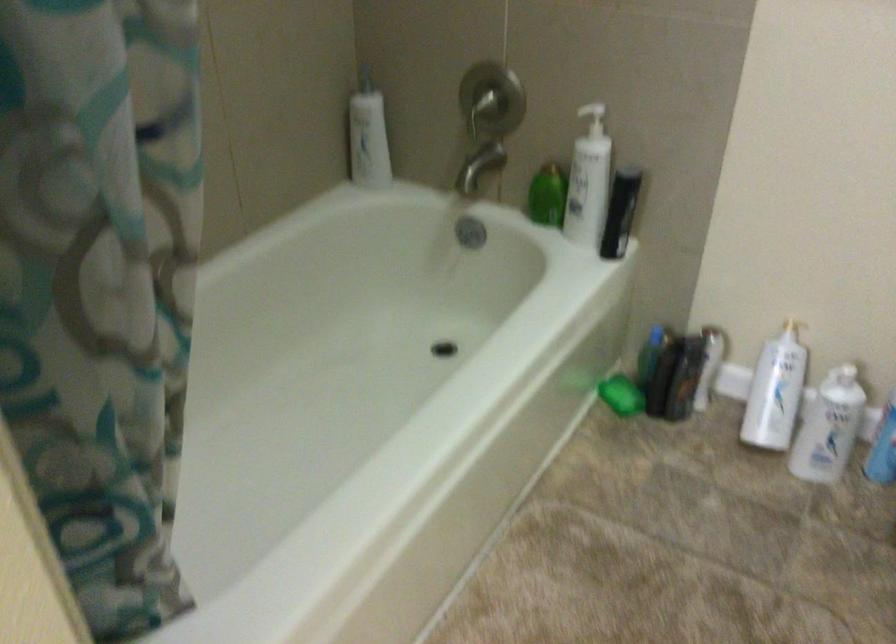
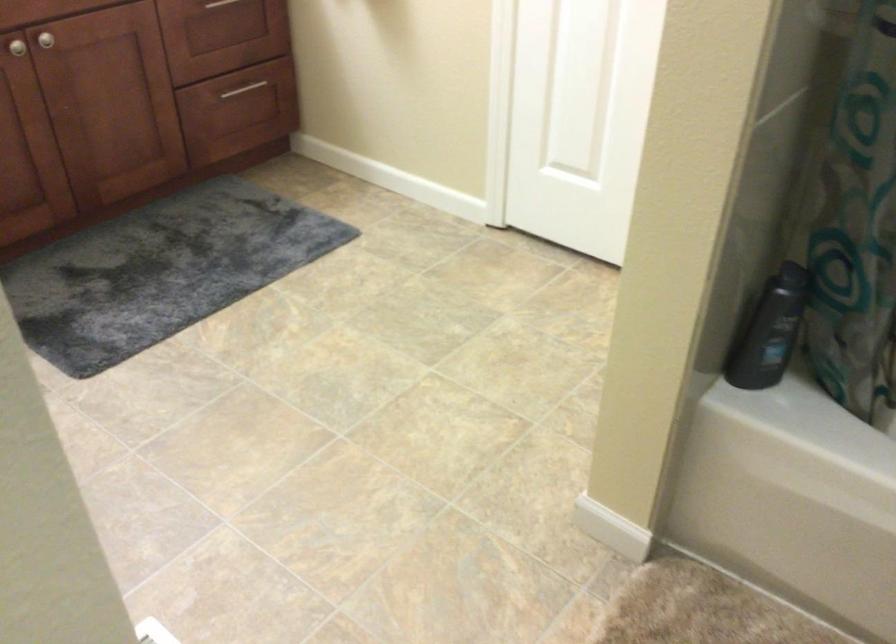
The images are taken continuously from a first-person perspective. In which direction is your viewpoint rotating?

The camera rotated toward left-down.